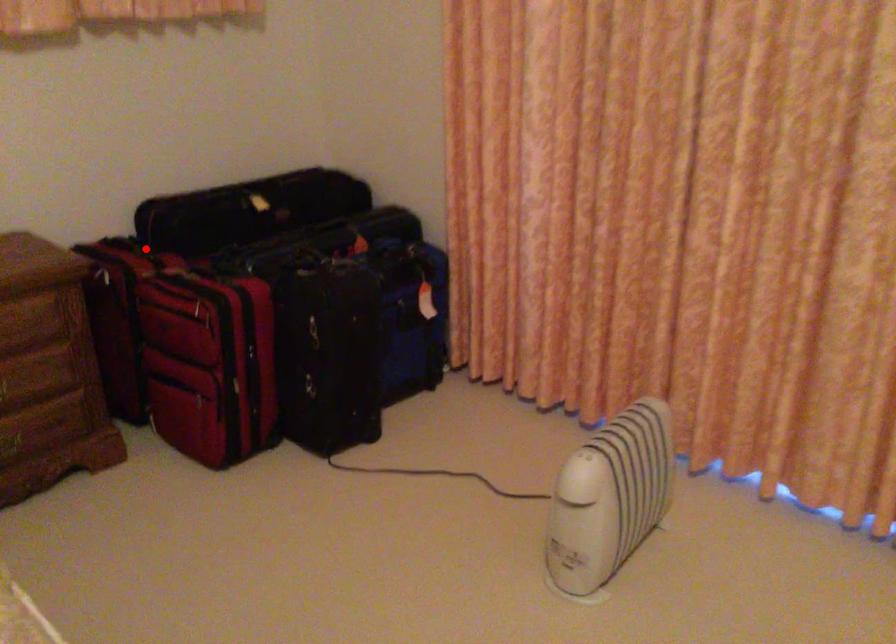
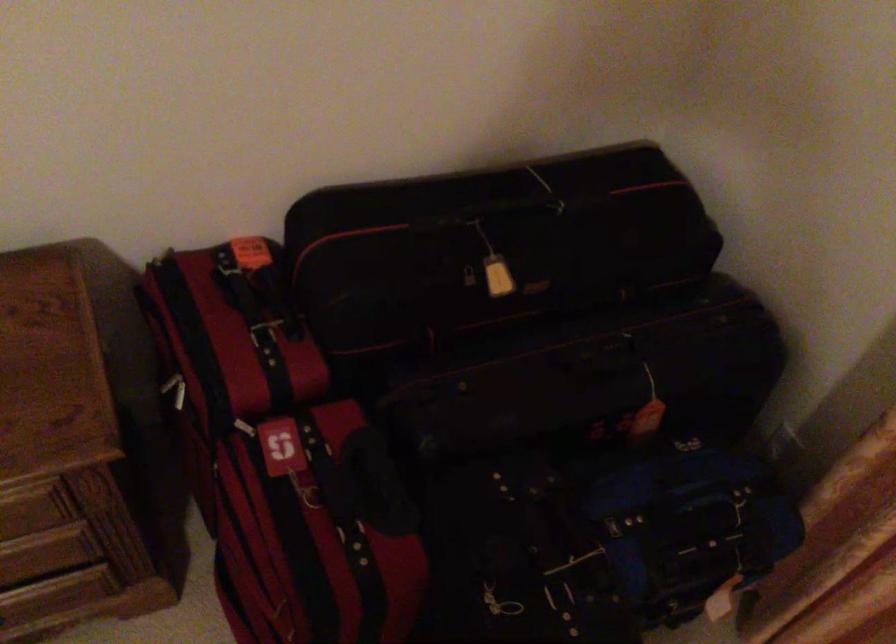
Question: I am providing you with two images of the same scene from different viewpoints. Given a red point in image1, look at the same physical point in image2. Is it:

Choices:
 (A) Closer to the viewpoint
 (B) Farther from the viewpoint

Answer: (A)